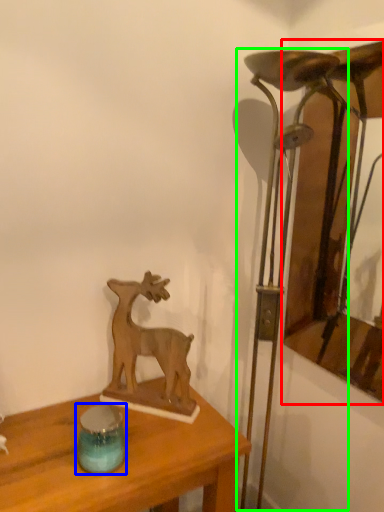
Question: Which object is positioned closest to picture frame (highlighted by a red box)? Select from candle holder (highlighted by a blue box) and table lamp (highlighted by a green box).

Choices:
 (A) candle holder
 (B) table lamp

Answer: (B)